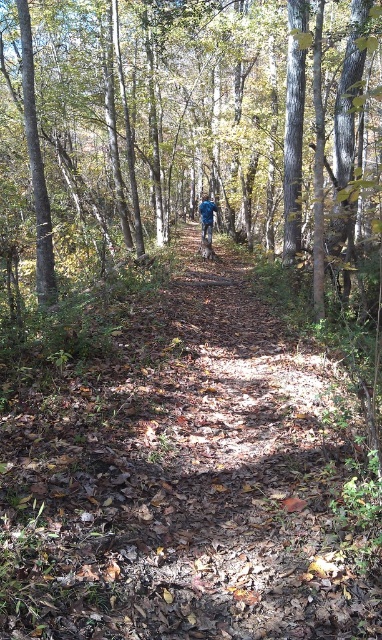
Question: Does brown wood tree at center appear on the right side of blue fabric jacket at center?

Choices:
 (A) yes
 (B) no

Answer: (B)

Question: Is brown wood tree at center thinner than blue fabric jacket at center?

Choices:
 (A) yes
 (B) no

Answer: (B)

Question: Is brown wood tree at center above blue fabric jacket at center?

Choices:
 (A) yes
 (B) no

Answer: (A)

Question: Which point is closer to the camera?

Choices:
 (A) (189, 100)
 (B) (200, 202)

Answer: (A)

Question: Which object is closer to the camera taking this photo?

Choices:
 (A) blue fabric jacket at center
 (B) brown wood tree at center

Answer: (B)